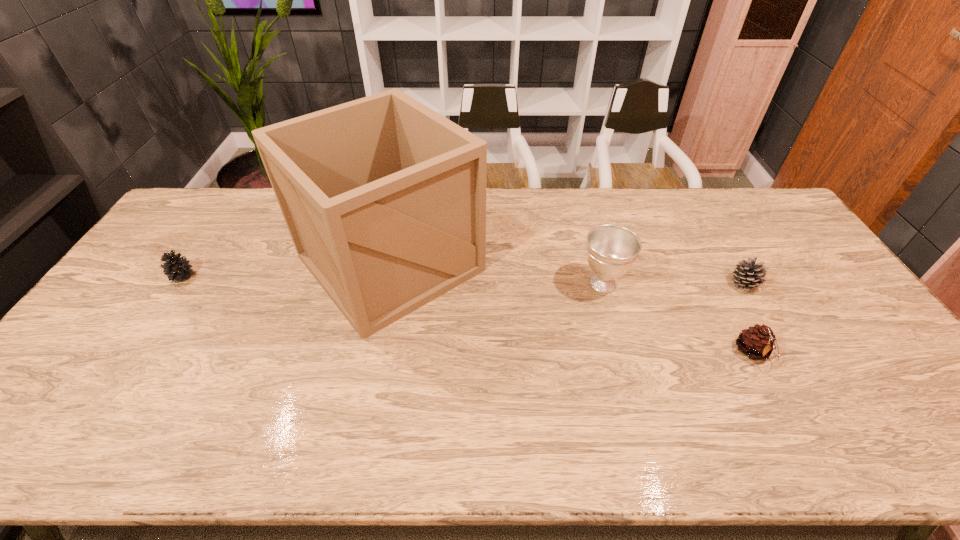
Find the location of `free space between the fourth shortest object and the nearest pinecone`. free space between the fourth shortest object and the nearest pinecone is located at coordinates (678, 319).

You are a GUI agent. You are given a task and a screenshot of the screen. Output one action in this format:
    pyautogui.click(x=<x>, y=<y>)
    Task: Click on the free area in between the second object from left to right and the leftmost pinecone
    This screenshot has height=540, width=960.
    Given the screenshot: What is the action you would take?
    pyautogui.click(x=286, y=269)

Where is `object identified as the fourth closest to the second tallest object`? Image resolution: width=960 pixels, height=540 pixels. object identified as the fourth closest to the second tallest object is located at coordinates (177, 268).

Identify which object is located as the third nearest to the third object from right to left. Please provide its 2D coordinates. Your answer should be formatted as a tuple, i.e. [(x, y)], where the tuple contains the x and y coordinates of a point satisfying the conditions above.

[(747, 275)]

Identify which pinecone is the second nearest to the nearest pinecone. Please provide its 2D coordinates. Your answer should be formatted as a tuple, i.e. [(x, y)], where the tuple contains the x and y coordinates of a point satisfying the conditions above.

[(177, 268)]

Select which pinecone appears as the closest to the box. Please provide its 2D coordinates. Your answer should be formatted as a tuple, i.e. [(x, y)], where the tuple contains the x and y coordinates of a point satisfying the conditions above.

[(177, 268)]